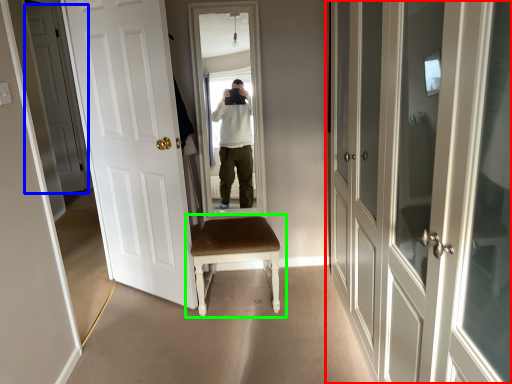
Question: Estimate the real-world distances between objects in this image. Which object is farther from door (highlighted by a red box), door (highlighted by a blue box) or chair (highlighted by a green box)?

Choices:
 (A) door
 (B) chair

Answer: (A)